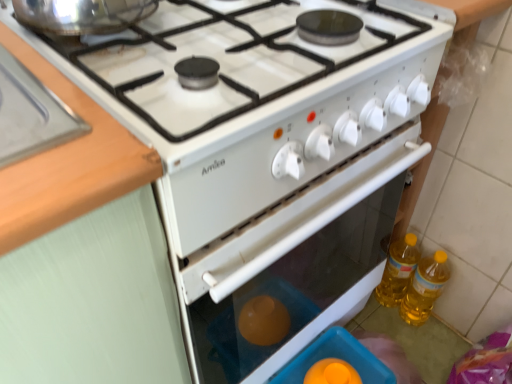
Question: Does wooden at left appear on the left side of yellow translucent bottle at right, arranged as the second bottle when viewed from the right?

Choices:
 (A) no
 (B) yes

Answer: (B)

Question: Does wooden at left appear on the right side of yellow translucent bottle at right, arranged as the second bottle when viewed from the right?

Choices:
 (A) yes
 (B) no

Answer: (B)

Question: Can yellow translucent bottle at right, which appears as the 1th bottle when viewed from the left, be found inside wooden at left?

Choices:
 (A) yes
 (B) no

Answer: (B)

Question: Does wooden at left turn towards yellow translucent bottle at right, arranged as the second bottle when viewed from the right?

Choices:
 (A) yes
 (B) no

Answer: (B)

Question: From a real-world perspective, is wooden at left positioned under yellow translucent bottle at right, which appears as the 1th bottle when viewed from the left, based on gravity?

Choices:
 (A) no
 (B) yes

Answer: (A)

Question: In terms of size, does wooden at left appear bigger or smaller than yellow translucent bottle at lower right, acting as the second bottle starting from the left?

Choices:
 (A) big
 (B) small

Answer: (A)

Question: Considering the positions of wooden at left and yellow translucent bottle at lower right, acting as the second bottle starting from the left, in the image, is wooden at left taller or shorter than yellow translucent bottle at lower right, acting as the second bottle starting from the left,?

Choices:
 (A) tall
 (B) short

Answer: (B)

Question: From the image's perspective, is wooden at left located above or below yellow translucent bottle at lower right, acting as the second bottle starting from the left?

Choices:
 (A) below
 (B) above

Answer: (B)

Question: Would you say wooden at left is to the left or to the right of yellow translucent bottle at lower right, acting as the second bottle starting from the left, in the picture?

Choices:
 (A) left
 (B) right

Answer: (A)

Question: Is yellow translucent bottle at right, which appears as the 1th bottle when viewed from the left, wider or thinner than yellow translucent bottle at lower right, acting as the second bottle starting from the left?

Choices:
 (A) wide
 (B) thin

Answer: (A)

Question: Considering their positions, is yellow translucent bottle at right, which appears as the 1th bottle when viewed from the left, located in front of or behind yellow translucent bottle at lower right, acting as the first bottle starting from the right?

Choices:
 (A) front
 (B) behind

Answer: (B)

Question: Visually, is yellow translucent bottle at right, arranged as the second bottle when viewed from the right, positioned to the left or to the right of yellow translucent bottle at lower right, acting as the second bottle starting from the left?

Choices:
 (A) left
 (B) right

Answer: (A)

Question: From the image's perspective, is yellow translucent bottle at right, arranged as the second bottle when viewed from the right, positioned above or below yellow translucent bottle at lower right, acting as the first bottle starting from the right?

Choices:
 (A) below
 (B) above

Answer: (B)

Question: In terms of width, does wooden at left look wider or thinner when compared to translucent plastic container at lower center?

Choices:
 (A) thin
 (B) wide

Answer: (B)

Question: From the image's perspective, is wooden at left positioned above or below translucent plastic container at lower center?

Choices:
 (A) below
 (B) above

Answer: (B)